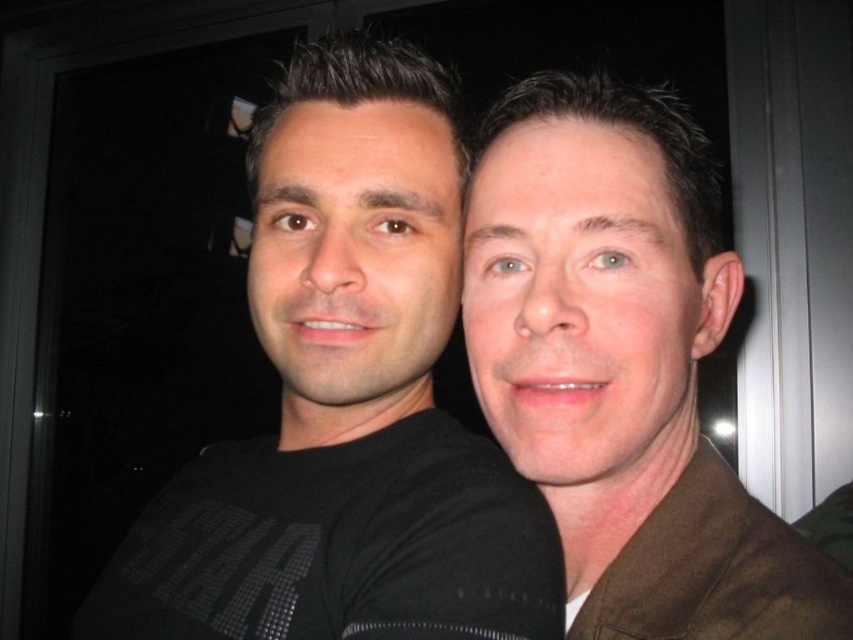
Is black matte shirt at left below brown matte jacket at right?

No.

Between point (543, 524) and point (573, 182), which one is positioned behind?

Positioned behind is point (543, 524).

Who is more forward, (457, 262) or (485, 150)?

Point (485, 150) is in front.

Find the location of a particular element. black matte shirt at left is located at coordinates coord(346,401).